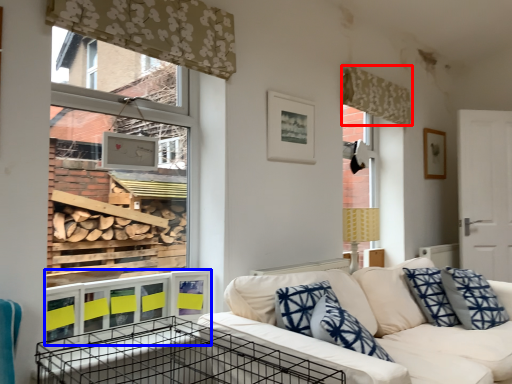
Question: Which of the following is the farthest to the observer, curtain (highlighted by a red box) or window sill (highlighted by a blue box)?

Choices:
 (A) curtain
 (B) window sill

Answer: (A)